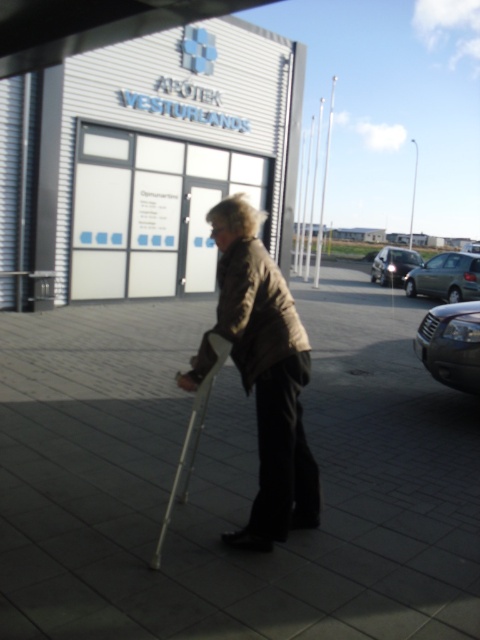
Who is positioned more to the right, shiny metallic car at right or metallic gray sedan at right?

From the viewer's perspective, metallic gray sedan at right appears more on the right side.

The width and height of the screenshot is (480, 640). Describe the element at coordinates (451, 344) in the screenshot. I see `shiny metallic car at right` at that location.

Which is behind, point (469, 385) or point (437, 268)?

Point (437, 268)

Locate an element on the screen. The image size is (480, 640). shiny metallic car at right is located at coordinates (451, 344).

In the scene shown: Is gray concrete pavement at center to the left of brown matte jacket at center from the viewer's perspective?

Correct, you'll find gray concrete pavement at center to the left of brown matte jacket at center.

At what (x,y) coordinates should I click in order to perform the action: click on gray concrete pavement at center. Please return your answer as a coordinate pair (x, y). Looking at the image, I should click on (231, 480).

The image size is (480, 640). What do you see at coordinates (231, 480) in the screenshot?
I see `gray concrete pavement at center` at bounding box center [231, 480].

The height and width of the screenshot is (640, 480). Find the location of `gray concrete pavement at center`. gray concrete pavement at center is located at coordinates (231, 480).

Does point (421, 284) lie in front of point (173, 492)?

No, (421, 284) is behind (173, 492).

Who is positioned more to the right, metallic gray sedan at right or white plastic crutch at center?

metallic gray sedan at right is more to the right.

Does point (408, 280) come closer to viewer compared to point (192, 433)?

No, it is behind (192, 433).

Locate an element on the screen. Image resolution: width=480 pixels, height=640 pixels. metallic gray sedan at right is located at coordinates (445, 276).